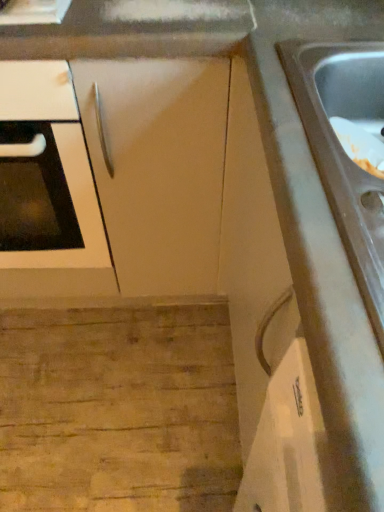
Question: Should I look upward or downward to see stainless steel sink at right?

Choices:
 (A) down
 (B) up

Answer: (B)

Question: Can you confirm if matte white cabinet at center is wider than stainless steel sink at right?

Choices:
 (A) yes
 (B) no

Answer: (A)

Question: Is matte white cabinet at center smaller than stainless steel sink at right?

Choices:
 (A) no
 (B) yes

Answer: (A)

Question: Is matte white cabinet at center facing towards stainless steel sink at right?

Choices:
 (A) no
 (B) yes

Answer: (A)

Question: Are matte white cabinet at center and stainless steel sink at right located far from each other?

Choices:
 (A) yes
 (B) no

Answer: (B)

Question: From a real-world perspective, is matte white cabinet at center under stainless steel sink at right?

Choices:
 (A) no
 (B) yes

Answer: (B)

Question: Is matte white cabinet at center placed right next to stainless steel sink at right?

Choices:
 (A) yes
 (B) no

Answer: (B)

Question: Is white glossy oven at left to the left of matte white cabinet at center from the viewer's perspective?

Choices:
 (A) yes
 (B) no

Answer: (A)

Question: From a real-world perspective, is white glossy oven at left located beneath matte white cabinet at center?

Choices:
 (A) yes
 (B) no

Answer: (A)

Question: Are white glossy oven at left and matte white cabinet at center located far from each other?

Choices:
 (A) yes
 (B) no

Answer: (B)

Question: From the image's perspective, is white glossy oven at left beneath matte white cabinet at center?

Choices:
 (A) no
 (B) yes

Answer: (B)

Question: Does white glossy oven at left have a lesser width compared to matte white cabinet at center?

Choices:
 (A) no
 (B) yes

Answer: (B)

Question: Can you confirm if white glossy oven at left is smaller than matte white cabinet at center?

Choices:
 (A) yes
 (B) no

Answer: (B)

Question: Could matte white cabinet at center be considered to be inside stainless steel sink at right?

Choices:
 (A) no
 (B) yes

Answer: (A)